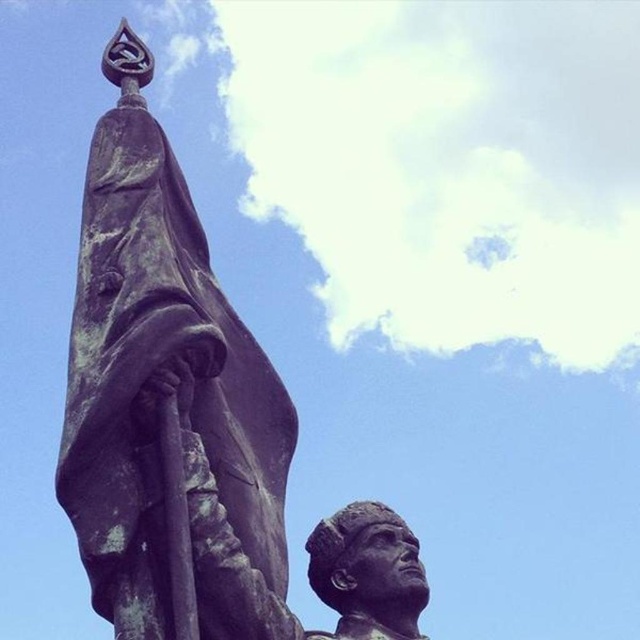
You are a photographer standing at the center of the scene. You want to take a photo of the bronze statue at left. Which direction should you face to capture it in your shot?

Since the bronze statue at left is located at point (168, 403), you should face towards the left side of the scene to capture it in your shot.

You are a photographer standing in front of the statue. You want to take a photo where both points, point [273,500] and point [348,572], are clearly visible. Since you want to ensure the points are in focus, which point should you focus on first to capture both in the clearest possible way?

You should focus on point [273,500] first because it is closer to the camera than point [348,572]. By focusing on the closer point, the farther point will also be in focus due to the depth of field.

You are an art student analyzing the statue. You notice the bronze statue at left and the bronze statue head at center. Which one appears bigger in size?

The bronze statue at left is larger in size compared to the bronze statue head at center.